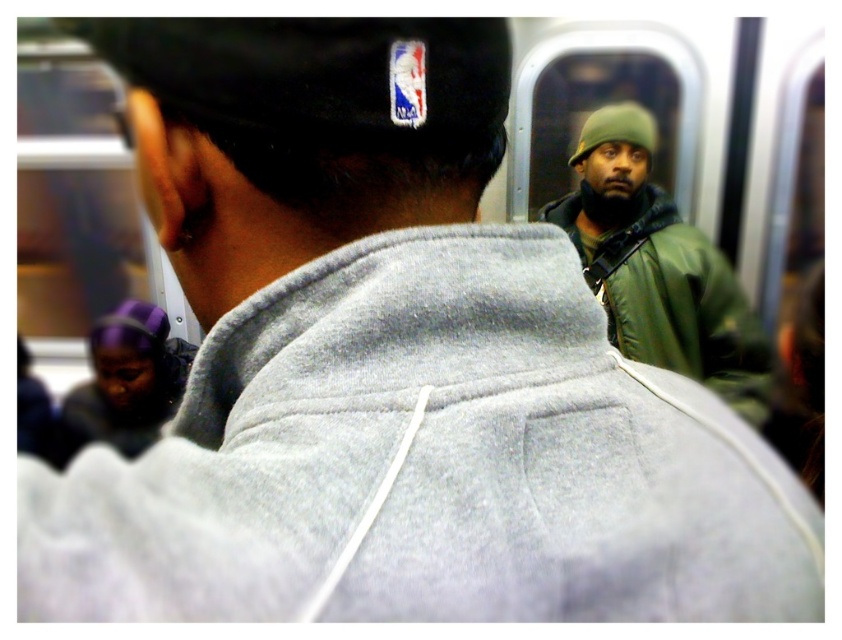
Does green matte jacket at center have a smaller size compared to green matte baseball hat at upper center?

No, green matte jacket at center is not smaller than green matte baseball hat at upper center.

Consider the image. Can you confirm if green matte jacket at center is positioned above green matte baseball hat at upper center?

No, green matte jacket at center is not above green matte baseball hat at upper center.

This screenshot has height=640, width=842. Describe the element at coordinates (658, 266) in the screenshot. I see `green matte jacket at center` at that location.

The height and width of the screenshot is (640, 842). I want to click on green matte jacket at center, so click(658, 266).